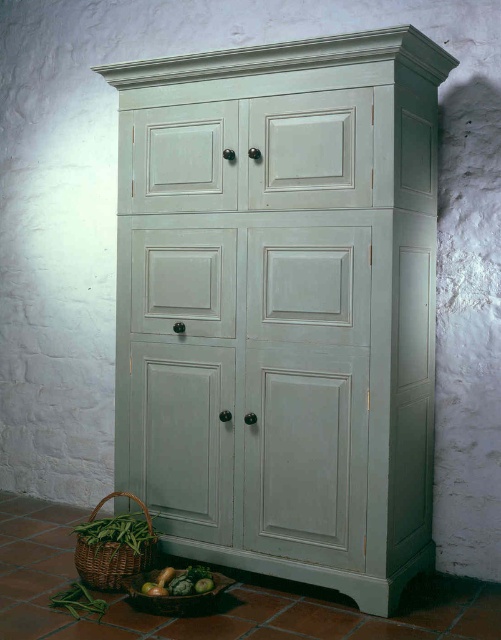
Question: Does green matte beans at lower left have a lesser width compared to green matte cucumber at lower left?

Choices:
 (A) no
 (B) yes

Answer: (A)

Question: Is the position of light green painted wood dresser at center less distant than that of green matte vegetable at lower left?

Choices:
 (A) no
 (B) yes

Answer: (B)

Question: Which point is farther from the camera taking this photo?

Choices:
 (A) (130, 259)
 (B) (208, 579)
 (C) (97, 532)
 (D) (92, 595)

Answer: (A)

Question: Observing the image, what is the correct spatial positioning of light green painted wood dresser at center in reference to green matte cucumber at lower left?

Choices:
 (A) left
 (B) right

Answer: (B)

Question: Which of the following is the farthest from the observer?

Choices:
 (A) (423, 554)
 (B) (72, 596)

Answer: (A)

Question: Which object appears closest to the camera in this image?

Choices:
 (A) green matte cucumber at lower center
 (B) light green painted wood dresser at center
 (C) green matte vegetable at lower left
 (D) green matte cucumber at lower left

Answer: (B)